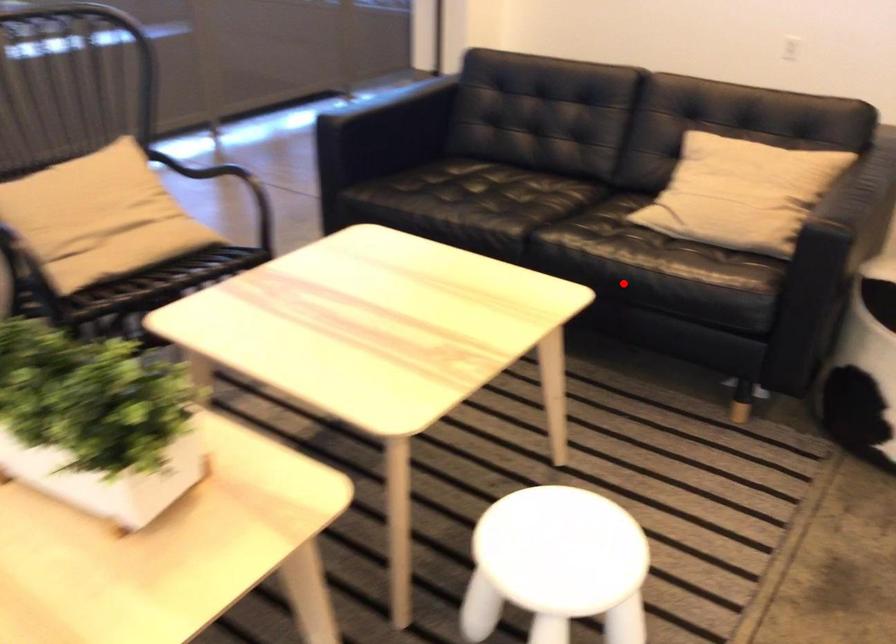
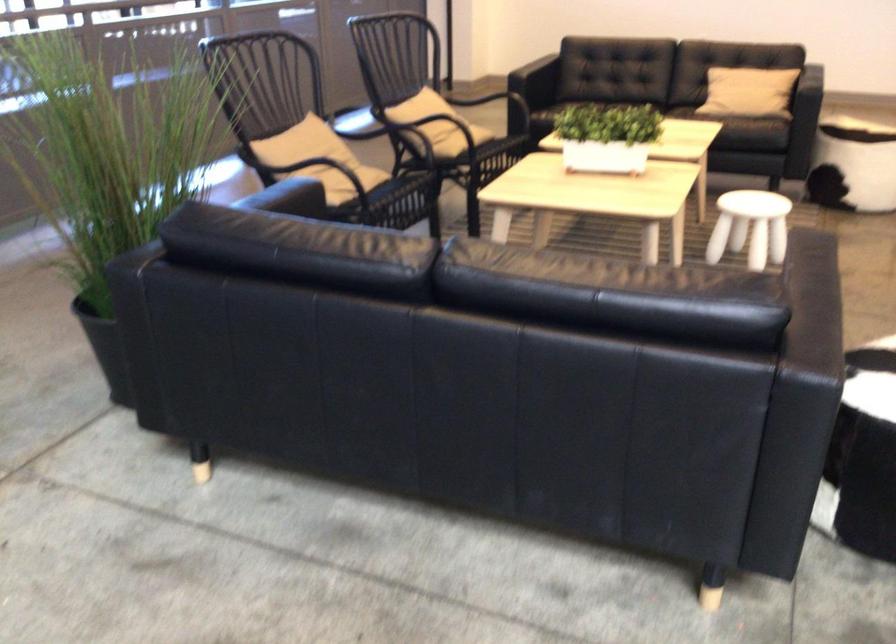
Locate, in the second image, the point that corresponds to the highlighted location in the first image.

(745, 120)